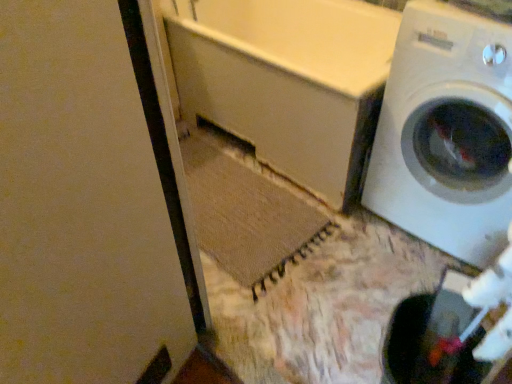
Question: Looking at their shapes, would you say white matte screen door at upper left is wider or thinner than white glossy washing machine at right?

Choices:
 (A) wide
 (B) thin

Answer: (B)

Question: Relative to white glossy washing machine at right, is white matte screen door at upper left in front or behind?

Choices:
 (A) front
 (B) behind

Answer: (A)

Question: Which is nearer to the white matte screen door at upper left?

Choices:
 (A) white glossy washing machine at right
 (B) white matte bathtub at center

Answer: (B)

Question: Estimate the real-world distances between objects in this image. Which object is farther from the white matte bathtub at center?

Choices:
 (A) white matte screen door at upper left
 (B) white glossy washing machine at right

Answer: (A)